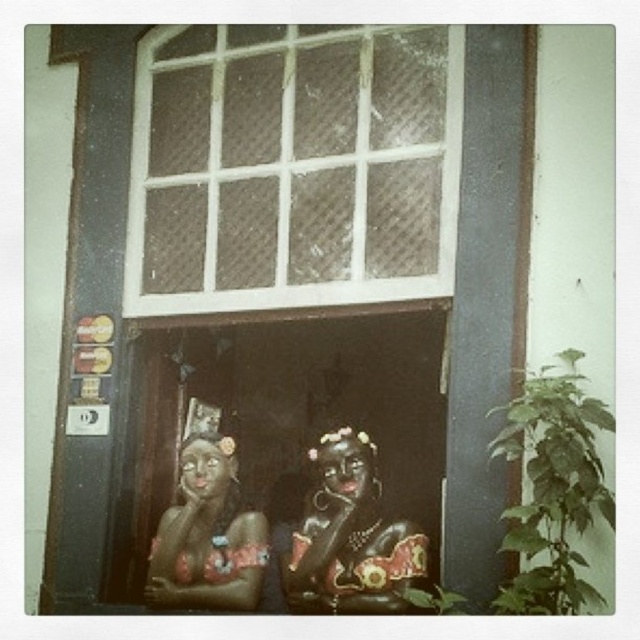
Is white mesh screen at upper center positioned at the back of matte ceramic statue at center?

That is False.

Where is `white mesh screen at upper center`? This screenshot has width=640, height=640. white mesh screen at upper center is located at coordinates (292, 168).

Is point (358, 209) positioned after point (364, 509)?

That is False.

The image size is (640, 640). In order to click on white mesh screen at upper center in this screenshot , I will do `click(292, 168)`.

Locate an element on the screen. The image size is (640, 640). white mesh screen at upper center is located at coordinates (292, 168).

Who is more forward, [346,545] or [227,538]?

Point [346,545] is more forward.

Identify the location of black glossy statue at center. (349, 536).